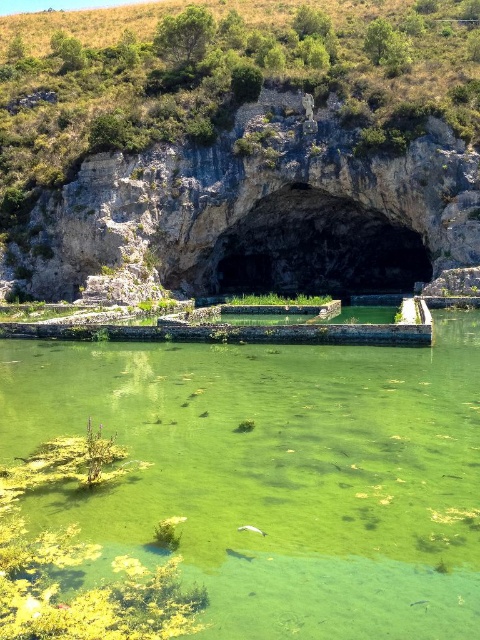
You are standing in front of the black stone cave at center and want to reach the rocky cliff at center. Which direction should you move relative to the cave?

The rocky cliff at center is to the left of the black stone cave at center, so you should move to the left to reach it.

You are planning to build a small garden between the rocky cliff at center and the black stone cave at center. Which object should you place the garden closer to if you want it to be sheltered from strong winds that usually come from the direction of the larger object?

The rocky cliff at center is larger than the black stone cave at center, so placing the garden closer to the rocky cliff at center would provide better shelter from the strong winds coming from its direction.

You are a hiker carrying a 20kg backpack and need to cross from the rocky cliff at center to the green algae pond at center. The path between them is narrow. What is the minimum width the path must have to allow you to pass safely?

The rocky cliff at center and green algae pond at center are 67.73 meters apart from each other. Since the path is narrow but the distance between them is over 67 meters, the path must be at least 67.73 meters wide to allow safe passage between the two points.